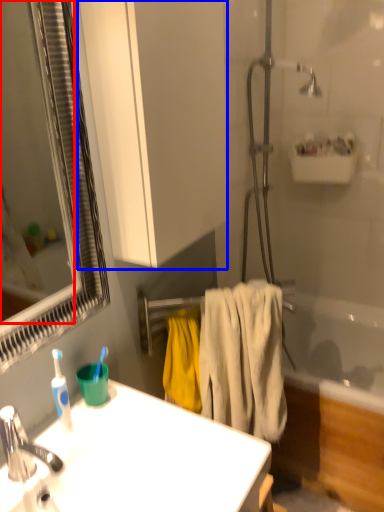
Question: Which object appears closest to the camera in this image, mirror (highlighted by a red box) or bathroom cabinet (highlighted by a blue box)?

Choices:
 (A) mirror
 (B) bathroom cabinet

Answer: (A)